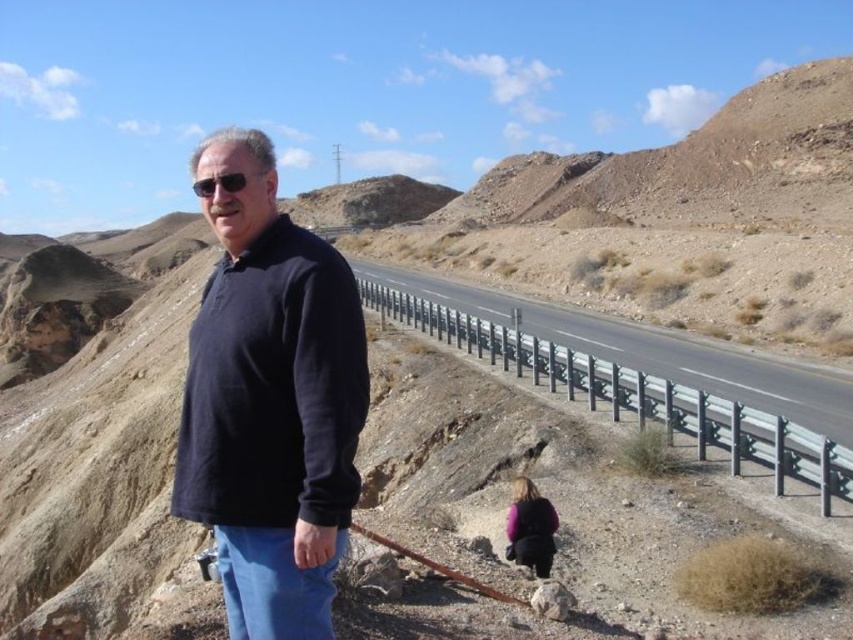
Does dark blue fleece at center have a lesser width compared to metallic gray highway at center?

No.

Between point (318, 422) and point (653, 364), which one is positioned behind?

The point (653, 364) is behind.

Describe the element at coordinates (270, 403) in the screenshot. I see `dark blue fleece at center` at that location.

Locate an element on the screen. The height and width of the screenshot is (640, 853). dark blue fleece at center is located at coordinates (270, 403).